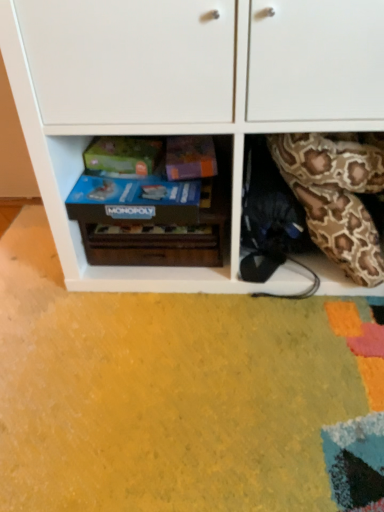
Question: From the image's perspective, does white matte cabinet at center appear lower than wooden monopoly game at center?

Choices:
 (A) no
 (B) yes

Answer: (A)

Question: Considering the relative sizes of white matte cabinet at center and wooden monopoly game at center in the image provided, is white matte cabinet at center taller than wooden monopoly game at center?

Choices:
 (A) no
 (B) yes

Answer: (B)

Question: From a real-world perspective, is white matte cabinet at center positioned over wooden monopoly game at center based on gravity?

Choices:
 (A) no
 (B) yes

Answer: (B)

Question: Is white matte cabinet at center to the left of wooden monopoly game at center from the viewer's perspective?

Choices:
 (A) yes
 (B) no

Answer: (B)

Question: Can you confirm if white matte cabinet at center is positioned to the right of wooden monopoly game at center?

Choices:
 (A) yes
 (B) no

Answer: (A)

Question: From the image's perspective, is white matte cabinet at center over wooden monopoly game at center?

Choices:
 (A) no
 (B) yes

Answer: (B)

Question: Does brown patterned fabric at right come in front of blue cardboard monopoly game at center?

Choices:
 (A) yes
 (B) no

Answer: (A)

Question: Is brown patterned fabric at right at the right side of blue cardboard monopoly game at center?

Choices:
 (A) yes
 (B) no

Answer: (A)

Question: Is brown patterned fabric at right oriented towards blue cardboard monopoly game at center?

Choices:
 (A) yes
 (B) no

Answer: (B)

Question: From the image's perspective, is brown patterned fabric at right on top of blue cardboard monopoly game at center?

Choices:
 (A) yes
 (B) no

Answer: (B)

Question: Is brown patterned fabric at right looking in the opposite direction of blue cardboard monopoly game at center?

Choices:
 (A) no
 (B) yes

Answer: (A)

Question: Considering the relative sizes of brown patterned fabric at right and blue cardboard monopoly game at center in the image provided, is brown patterned fabric at right thinner than blue cardboard monopoly game at center?

Choices:
 (A) yes
 (B) no

Answer: (A)

Question: Could you tell me if white matte cabinet at center is turned towards blue cardboard monopoly game at center?

Choices:
 (A) yes
 (B) no

Answer: (A)